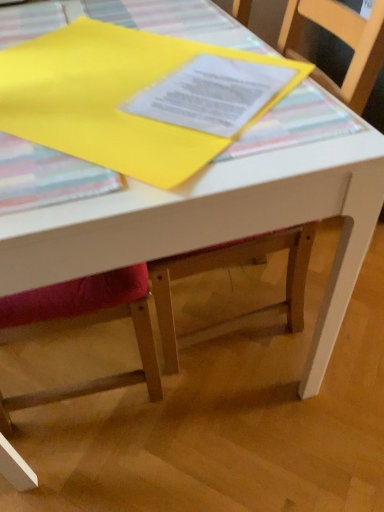
The height and width of the screenshot is (512, 384). Identify the location of blank space situated above yellow matte folder at upper center (from a real-world perspective). (115, 78).